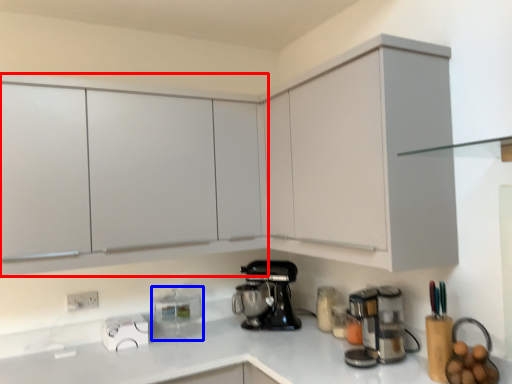
Question: Which object is closer to the camera taking this photo, cabinetry (highlighted by a red box) or kitchen appliance (highlighted by a blue box)?

Choices:
 (A) cabinetry
 (B) kitchen appliance

Answer: (A)